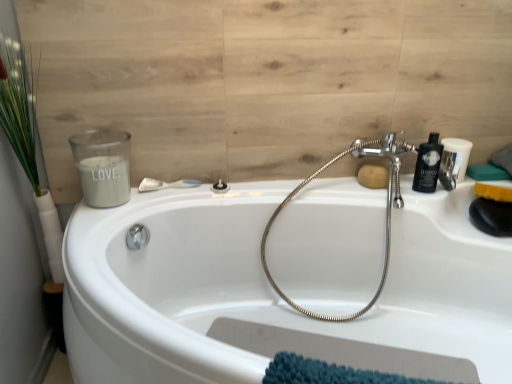
Question: Looking at the image, does matte black showerhead at center, the second shower from the left, seem bigger or smaller compared to green leafy plant at left?

Choices:
 (A) small
 (B) big

Answer: (A)

Question: Is matte black showerhead at center, the second shower from the left, inside the boundaries of green leafy plant at left, or outside?

Choices:
 (A) outside
 (B) inside

Answer: (A)

Question: Considering the real-world distances, which object is closest to the matte black toiletry at upper right?

Choices:
 (A) white matte candle at upper left
 (B) wooden panel at upper left
 (C) matte black showerhead at center, the second shower from the left
 (D) brown matte soap at upper right, which is counted as the second soap, starting from the right
 (E) white plastic shower at upper center, which is the second shower in right-to-left order

Answer: (D)

Question: Which object is positioned farthest from the white plastic shower at upper center, which is the second shower in right-to-left order?

Choices:
 (A) wooden panel at upper left
 (B) white matte candle at upper left
 (C) yellow sponge at right, arranged as the 2th soap when viewed from the left
 (D) brown matte soap at upper right, which is counted as the second soap, starting from the right
 (E) black plastic bottle at upper right

Answer: (C)